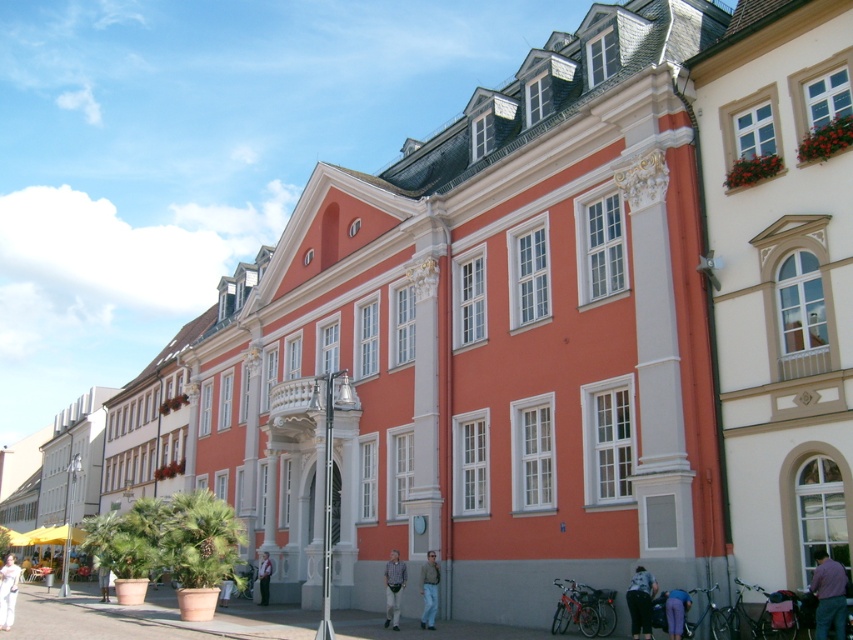
From the picture: Is striped cotton shirt at lower center to the left of white cotton dress at lower left from the viewer's perspective?

No, striped cotton shirt at lower center is not to the left of white cotton dress at lower left.

Find the location of a particular element. striped cotton shirt at lower center is located at coordinates (393, 588).

Locate an element on the screen. This screenshot has width=853, height=640. striped cotton shirt at lower center is located at coordinates (393, 588).

Locate an element on the screen. The height and width of the screenshot is (640, 853). striped cotton shirt at lower center is located at coordinates (393, 588).

Where is `dark blue jeans at lower center`? Image resolution: width=853 pixels, height=640 pixels. dark blue jeans at lower center is located at coordinates (640, 602).

Measure the distance between dark blue jeans at lower center and camera.

dark blue jeans at lower center is 127.39 feet from camera.

Between point (641, 570) and point (393, 580), which one is positioned behind?

The point (393, 580) is more distant.

Find the location of a particular element. The width and height of the screenshot is (853, 640). dark blue jeans at lower center is located at coordinates (640, 602).

Who is more distant from viewer, (10, 593) or (434, 604)?

The point (10, 593) is more distant.

Between white cotton dress at lower left and denim jeans at lower center, which one is positioned higher?

denim jeans at lower center is above.

Between point (0, 612) and point (421, 579), which one is positioned behind?

The point (421, 579) is more distant.

You are a GUI agent. You are given a task and a screenshot of the screen. Output one action in this format:
    pyautogui.click(x=<x>, y=<y>)
    Task: Click on the white cotton dress at lower left
    This screenshot has width=853, height=640.
    Given the screenshot: What is the action you would take?
    pyautogui.click(x=9, y=589)